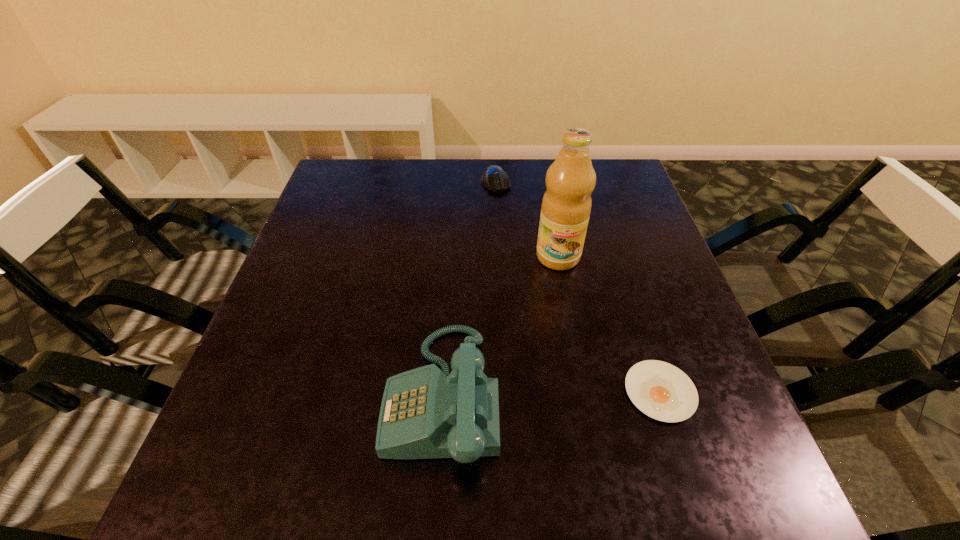
Where is `blank area in the image that satisfies the following two spatial constraints: 1. on the front side of the computer mouse; 2. on the right side of the second farthest object`? This screenshot has height=540, width=960. blank area in the image that satisfies the following two spatial constraints: 1. on the front side of the computer mouse; 2. on the right side of the second farthest object is located at coordinates (499, 256).